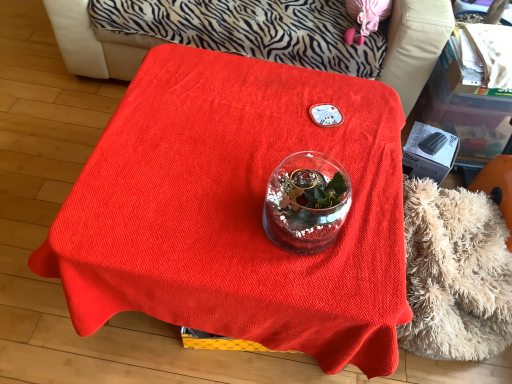
What do you see at coordinates (429, 152) in the screenshot?
I see `black plastic box at right` at bounding box center [429, 152].

Identify the location of black plastic box at right. The height and width of the screenshot is (384, 512). coord(429,152).

What do you see at coordinates (455, 274) in the screenshot?
I see `fluffy beige blanket at lower right` at bounding box center [455, 274].

This screenshot has height=384, width=512. What do you see at coordinates (415, 45) in the screenshot?
I see `smooth red tablecloth at center` at bounding box center [415, 45].

Measure the distance between point (300, 202) and camera.

A distance of 93.60 centimeters exists between point (300, 202) and camera.

Image resolution: width=512 pixels, height=384 pixels. I want to click on black plastic box at right, so click(x=429, y=152).

Considering the sizes of objects transparent glass vase at center and fluffy beige blanket at lower right in the image provided, who is bigger, transparent glass vase at center or fluffy beige blanket at lower right?

fluffy beige blanket at lower right is bigger.

This screenshot has height=384, width=512. I want to click on glass vase above the fluffy beige blanket at lower right (from the image's perspective), so click(305, 204).

Is transparent glass vase at center far away from fluffy beige blanket at lower right?

Actually, transparent glass vase at center and fluffy beige blanket at lower right are a little close together.

Is transparent glass vase at center positioned with its back to fluffy beige blanket at lower right?

transparent glass vase at center is not turned away from fluffy beige blanket at lower right.

Can you confirm if smooth red tablecloth at center is thinner than transparent glass vase at center?

In fact, smooth red tablecloth at center might be wider than transparent glass vase at center.

From a real-world perspective, relative to transparent glass vase at center, is smooth red tablecloth at center vertically above or below?

Clearly, from a real-world perspective, smooth red tablecloth at center is below transparent glass vase at center.

Who is bigger, smooth red tablecloth at center or transparent glass vase at center?

Bigger between the two is smooth red tablecloth at center.

From the image's perspective, between smooth red tablecloth at center and black plastic box at right, who is located below?

black plastic box at right.

In the scene shown: Which object is thinner, smooth red tablecloth at center or black plastic box at right?

black plastic box at right is thinner.

Is point (117, 34) closer or farther from the camera than point (413, 172)?

Clearly, point (117, 34) is more distant from the camera than point (413, 172).

Is smooth red tablecloth at center turned away from black plastic box at right?

No, smooth red tablecloth at center is not facing away from black plastic box at right.

Is fluffy beige blanket at lower right far away from black plastic box at right?

No, fluffy beige blanket at lower right is not far away from black plastic box at right.

Considering the relative sizes of fluffy beige blanket at lower right and black plastic box at right in the image provided, is fluffy beige blanket at lower right smaller than black plastic box at right?

Actually, fluffy beige blanket at lower right might be larger than black plastic box at right.

Can you confirm if fluffy beige blanket at lower right is wider than black plastic box at right?

Yes, fluffy beige blanket at lower right is wider than black plastic box at right.

Consider the image. Choose the correct answer: Is fluffy beige blanket at lower right inside black plastic box at right or outside it?

The correct answer is: outside.

Between black plastic box at right and transparent glass vase at center, which one has smaller width?

Thinner between the two is black plastic box at right.

Is black plastic box at right completely or partially outside of transparent glass vase at center?

Yes, black plastic box at right is outside of transparent glass vase at center.

In the image, is black plastic box at right positioned in front of or behind transparent glass vase at center?

black plastic box at right is positioned farther from the viewer than transparent glass vase at center.

Consider the image. Is black plastic box at right positioned with its back to red fabric covered table at center?

black plastic box at right does not have its back to red fabric covered table at center.

From the picture: Which of these two, black plastic box at right or red fabric covered table at center, is wider?

With larger width is red fabric covered table at center.

Which is behind, point (458, 140) or point (66, 237)?

The point (458, 140) is behind.

Does transparent glass vase at center appear on the right side of black plastic box at right?

No.

From the image's perspective, between transparent glass vase at center and black plastic box at right, who is located below?

From the image's view, transparent glass vase at center is below.

Is black plastic box at right at the back of transparent glass vase at center?

transparent glass vase at center is not turned away from black plastic box at right.

The width and height of the screenshot is (512, 384). I want to click on glass vase that is above the fluffy beige blanket at lower right (from the image's perspective), so click(x=305, y=204).

Where is `furniture directly beneath the transparent glass vase at center (from a real-world perspective)`? The image size is (512, 384). furniture directly beneath the transparent glass vase at center (from a real-world perspective) is located at coordinates (415, 45).

Looking at the image, which one is located closer to red fabric covered table at center, smooth red tablecloth at center or transparent glass vase at center?

transparent glass vase at center is closer to red fabric covered table at center.

Based on their spatial positions, is fluffy beige blanket at lower right or black plastic box at right closer to red fabric covered table at center?

Among the two, fluffy beige blanket at lower right is located nearer to red fabric covered table at center.

Based on their spatial positions, is red fabric covered table at center or transparent glass vase at center closer to fluffy beige blanket at lower right?

red fabric covered table at center.

Which object lies nearer to the anchor point smooth red tablecloth at center, fluffy beige blanket at lower right or red fabric covered table at center?

red fabric covered table at center lies closer to smooth red tablecloth at center than the other object.

Estimate the real-world distances between objects in this image. Which object is closer to black plastic box at right, smooth red tablecloth at center or transparent glass vase at center?

The object closer to black plastic box at right is transparent glass vase at center.

From the image, which object appears to be farther from black plastic box at right, red fabric covered table at center or fluffy beige blanket at lower right?

red fabric covered table at center.

Considering their positions, is red fabric covered table at center positioned further to smooth red tablecloth at center than fluffy beige blanket at lower right?

fluffy beige blanket at lower right is positioned further to the anchor smooth red tablecloth at center.

Estimate the real-world distances between objects in this image. Which object is further from transparent glass vase at center, red fabric covered table at center or fluffy beige blanket at lower right?

Among the two, fluffy beige blanket at lower right is located further to transparent glass vase at center.

The image size is (512, 384). Identify the location of table that lies between smooth red tablecloth at center and transparent glass vase at center from top to bottom. (236, 211).

Where is `table that lies between smooth red tablecloth at center and fluffy beige blanket at lower right from top to bottom`? The height and width of the screenshot is (384, 512). table that lies between smooth red tablecloth at center and fluffy beige blanket at lower right from top to bottom is located at coordinates (236, 211).

Where is `box located between red fabric covered table at center and fluffy beige blanket at lower right in the left-right direction`? The width and height of the screenshot is (512, 384). box located between red fabric covered table at center and fluffy beige blanket at lower right in the left-right direction is located at coordinates (429, 152).

Where is `box between smooth red tablecloth at center and red fabric covered table at center from top to bottom`? Image resolution: width=512 pixels, height=384 pixels. box between smooth red tablecloth at center and red fabric covered table at center from top to bottom is located at coordinates (x=429, y=152).